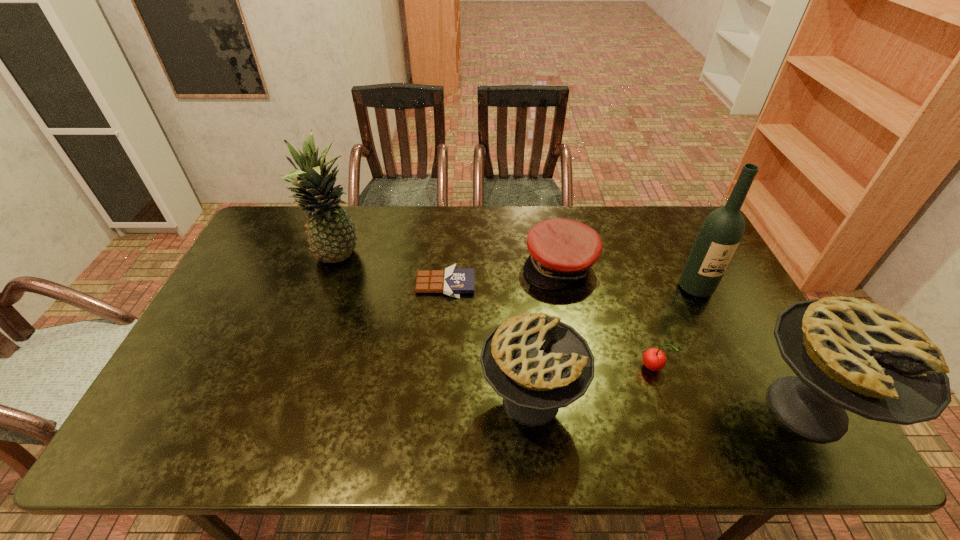
With all pies evenly spaced, where should an extra pie be placed on the left to continue the pattern? Please point out a vacant space. Please provide its 2D coordinates. Your answer should be formatted as a tuple, i.e. [(x, y)], where the tuple contains the x and y coordinates of a point satisfying the conditions above.

[(263, 393)]